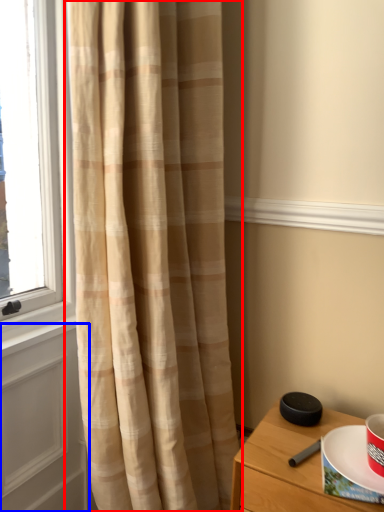
Question: Which object appears farthest to the camera in this image, curtain (highlighted by a red box) or screen door (highlighted by a blue box)?

Choices:
 (A) curtain
 (B) screen door

Answer: (B)